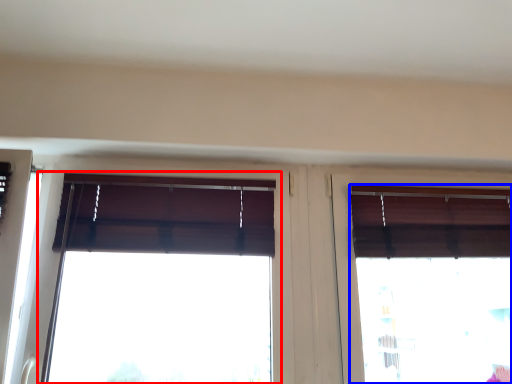
Question: Among these objects, which one is nearest to the camera, window (highlighted by a red box) or window (highlighted by a blue box)?

Choices:
 (A) window
 (B) window

Answer: (A)